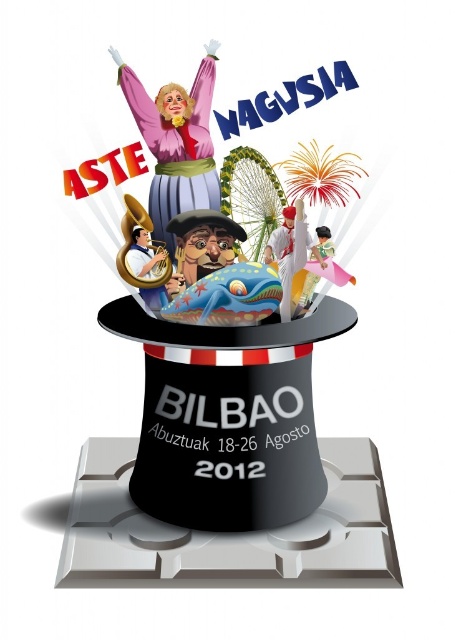
Question: Which of the following is the closest to the observer?

Choices:
 (A) matte black hat at center
 (B) matte pink dress at upper center

Answer: (A)

Question: Which of the following is the farthest from the observer?

Choices:
 (A) (382, 492)
 (B) (181, 192)

Answer: (A)

Question: Can you confirm if matte black hat at center is smaller than matte pink dress at upper center?

Choices:
 (A) no
 (B) yes

Answer: (A)

Question: Considering the relative positions of matte black hat at center and matte pink dress at upper center in the image provided, where is matte black hat at center located with respect to matte pink dress at upper center?

Choices:
 (A) right
 (B) left

Answer: (A)

Question: Does matte black hat at center have a larger size compared to matte pink dress at upper center?

Choices:
 (A) yes
 (B) no

Answer: (A)

Question: Which point is farther to the camera?

Choices:
 (A) matte black hat at center
 (B) matte pink dress at upper center

Answer: (B)